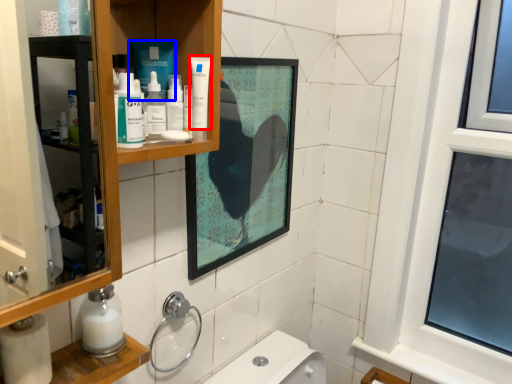
Question: Which point is further to the camera, toothpaste (highlighted by a red box) or product (highlighted by a blue box)?

Choices:
 (A) toothpaste
 (B) product

Answer: (B)